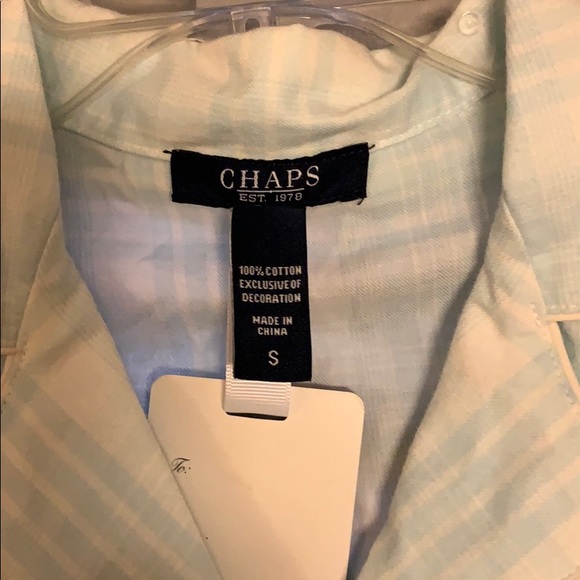
The image size is (580, 580). Identify the location of plastic hanger. (105, 50), (369, 20).